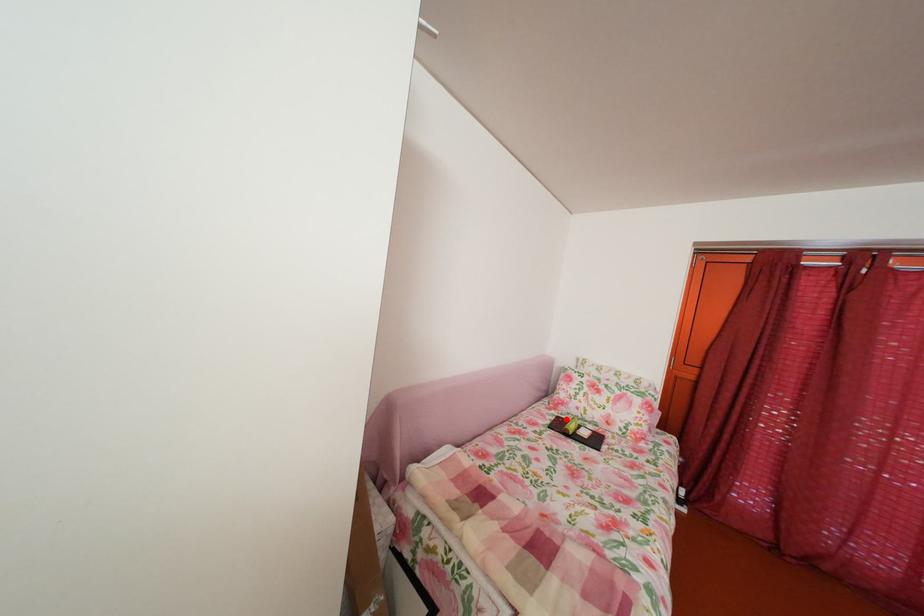
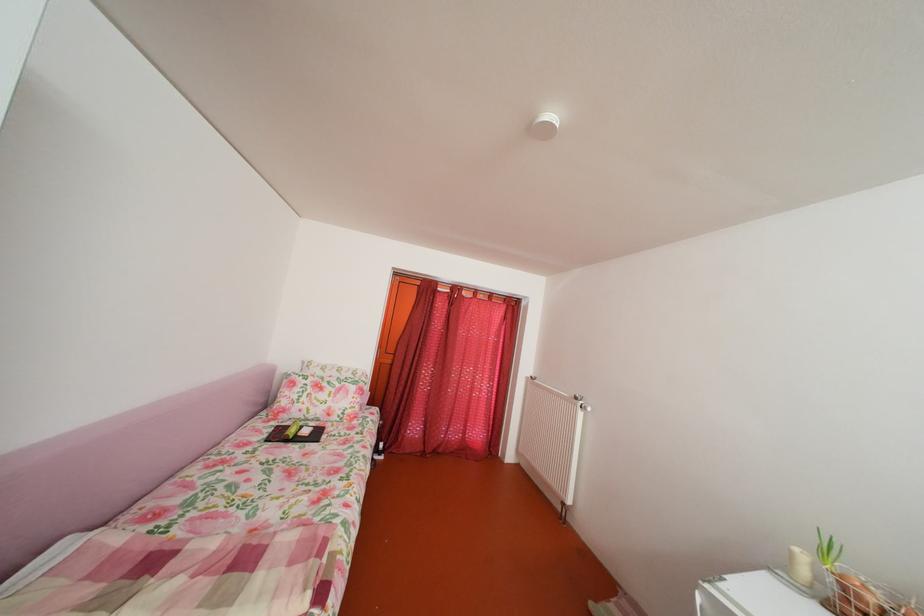
Question: I am providing you with two images of the same scene from different viewpoints. Given a red point in image1, look at the same physical point in image2. Is it:

Choices:
 (A) Closer to the viewpoint
 (B) Farther from the viewpoint

Answer: (B)